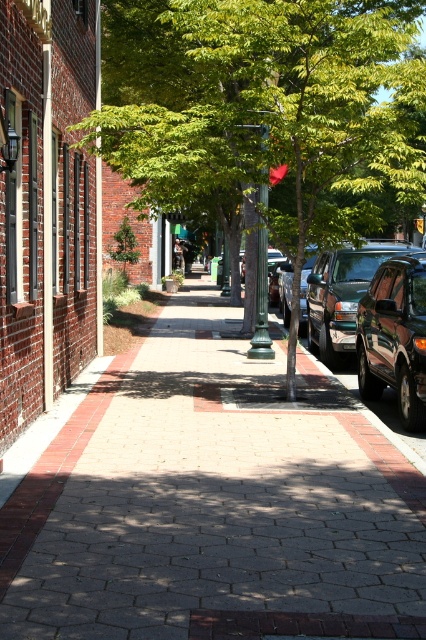
You are a delivery person with a cart that is 3 feet wide. You need to move from the brick pavement at center to the shiny dark green suv at right. Is there enough space between them for your cart to pass through?

The distance between the brick pavement at center and the shiny dark green suv at right is 11.94 feet. Since your cart is only 3 feet wide, there is more than enough space for it to pass through comfortably.

You are a delivery person with a 2.5 meter wide cart. You want to drive your cart through the area between the brick pavement at center and the green leafy tree at center. Is there enough space for your cart to pass through?

The brick pavement at center is narrower than the green leafy tree at center, but the description only states their widths relative to each other. Without specific measurements, it is impossible to determine if the space between them is at least 2.5 meters wide. Additional information about the actual width of either object is needed to answer this question accurately.